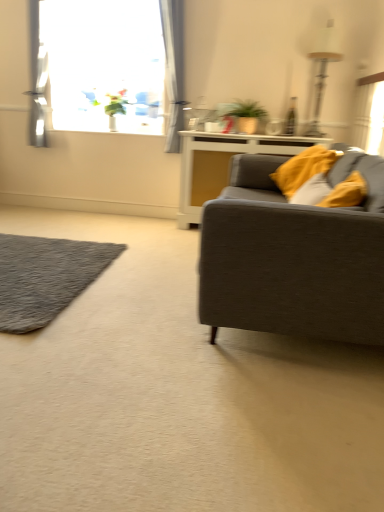
Question: Does point (294, 189) appear closer or farther from the camera than point (178, 49)?

Choices:
 (A) farther
 (B) closer

Answer: (B)

Question: Considering their positions, is soft yellow pillow at right located in front of or behind transparent glass window at upper left?

Choices:
 (A) front
 (B) behind

Answer: (A)

Question: Which of these objects is positioned farthest from the light gray sheer curtain at upper left?

Choices:
 (A) soft yellow pillow at right
 (B) matte white cabinet at center
 (C) gray shaggy rug at lower left
 (D) textured gray couch at right
 (E) transparent glass window at upper left

Answer: (D)

Question: Estimate the real-world distances between objects in this image. Which object is farther from the textured gray couch at right?

Choices:
 (A) light gray sheer curtain at upper left
 (B) transparent glass window at upper left
 (C) soft yellow pillow at right
 (D) matte white cabinet at center
 (E) gray shaggy rug at lower left

Answer: (B)